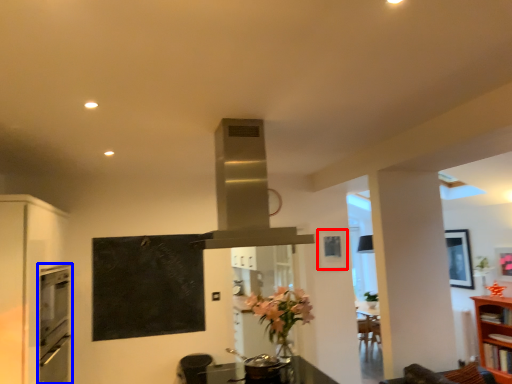
Question: Which of the following is the closest to the observer, picture frame (highlighted by a red box) or oven (highlighted by a blue box)?

Choices:
 (A) picture frame
 (B) oven

Answer: (B)